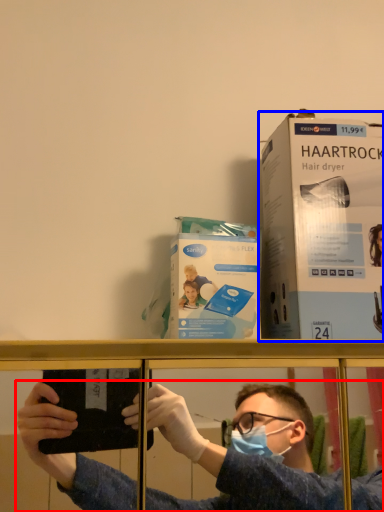
Question: Among these objects, which one is farthest to the camera, person (highlighted by a red box) or paperback book (highlighted by a blue box)?

Choices:
 (A) person
 (B) paperback book

Answer: (B)